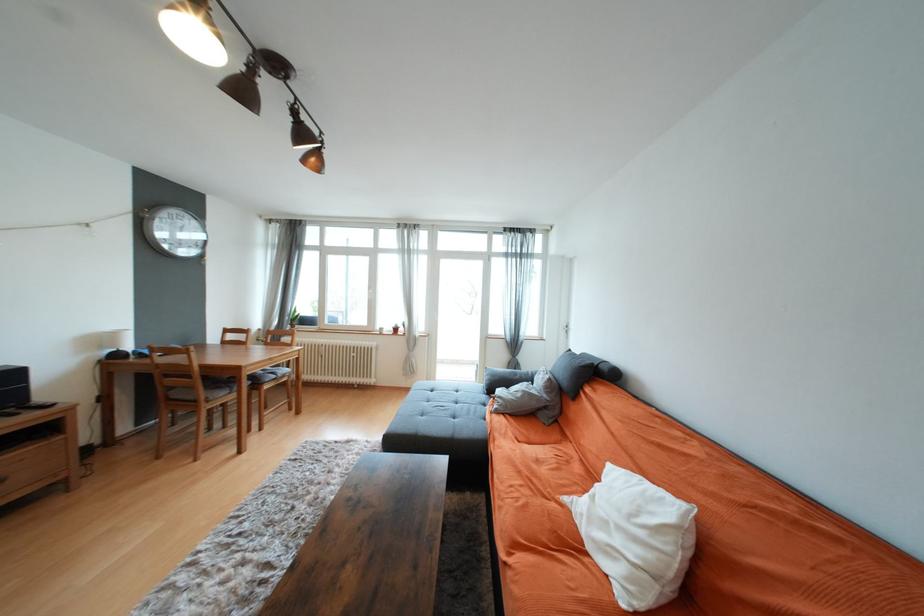
Where would you adjust the ceiling spotlight? Please return your answer as a coordinate pair (x, y).

(239, 69)